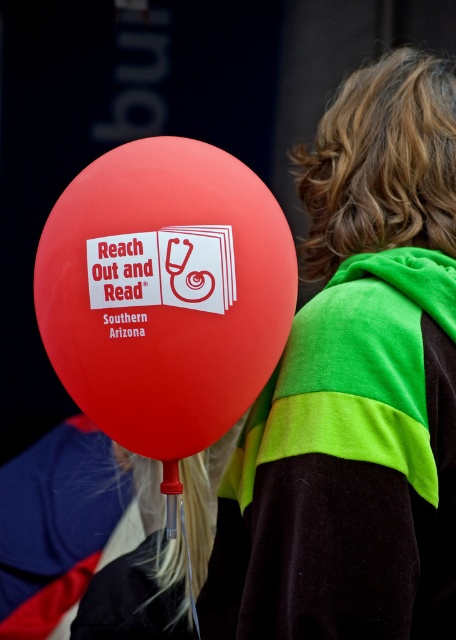
You are holding a 1.5 meter long pole. You want to touch the matte red balloon at left with the pole. Can you reach it?

The matte red balloon at left is 1.52 meters from camera. Since the pole is 1.5 meters long, you cannot reach it because the distance is slightly longer than the pole.